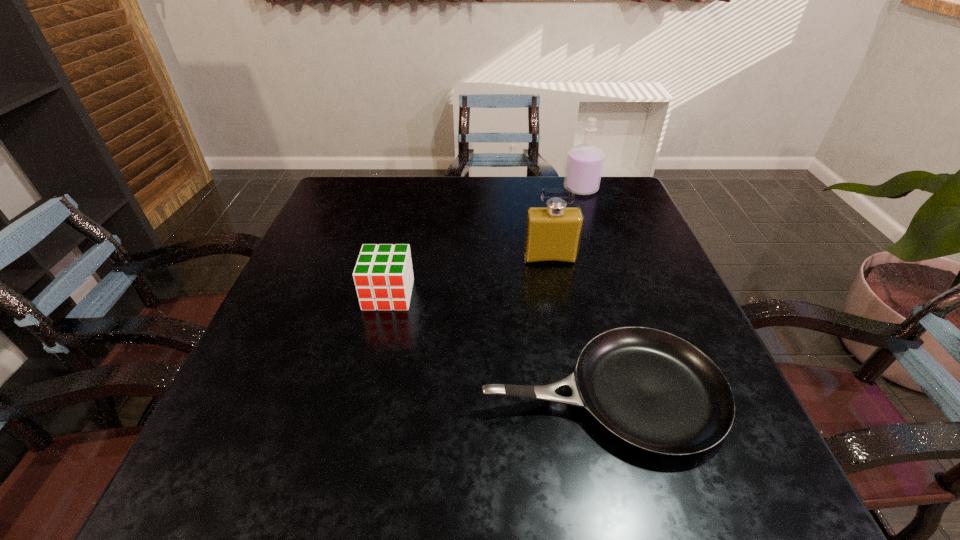
At what (x,y) coordinates should I click in order to perform the action: click on empty location between the third nearest object and the second shortest object. Please return your answer as a coordinate pair (x, y). This screenshot has height=540, width=960. Looking at the image, I should click on (469, 276).

The height and width of the screenshot is (540, 960). In order to click on free point between the left perfume and the shortest object in this screenshot , I will do `click(576, 326)`.

Locate an element on the screen. The width and height of the screenshot is (960, 540). free space between the second nearest object and the shortest object is located at coordinates (495, 345).

Where is `unoccupied position between the nearest object and the shorter perfume`? Image resolution: width=960 pixels, height=540 pixels. unoccupied position between the nearest object and the shorter perfume is located at coordinates (576, 326).

Where is `the second closest object to the cube`? This screenshot has height=540, width=960. the second closest object to the cube is located at coordinates (553, 233).

Identify the location of the third closest object to the right perfume. The width and height of the screenshot is (960, 540). (383, 275).

You are a GUI agent. You are given a task and a screenshot of the screen. Output one action in this format:
    pyautogui.click(x=<x>, y=<y>)
    Task: Click on the free spot that satisfies the following two spatial constraints: 1. on the front-facing side of the third shortest object; 2. on the right side of the nearest object
    
    Given the screenshot: What is the action you would take?
    pyautogui.click(x=575, y=394)

Where is `free space that satisfies the following two spatial constraints: 1. on the front-facing side of the left perfume; 2. on the right side of the shortest object`? The image size is (960, 540). free space that satisfies the following two spatial constraints: 1. on the front-facing side of the left perfume; 2. on the right side of the shortest object is located at coordinates (575, 394).

This screenshot has height=540, width=960. Find the location of `vacant area that satisfies the following two spatial constraints: 1. on the front-facing side of the nearer perfume; 2. on the right side of the shortest object`. vacant area that satisfies the following two spatial constraints: 1. on the front-facing side of the nearer perfume; 2. on the right side of the shortest object is located at coordinates 575,394.